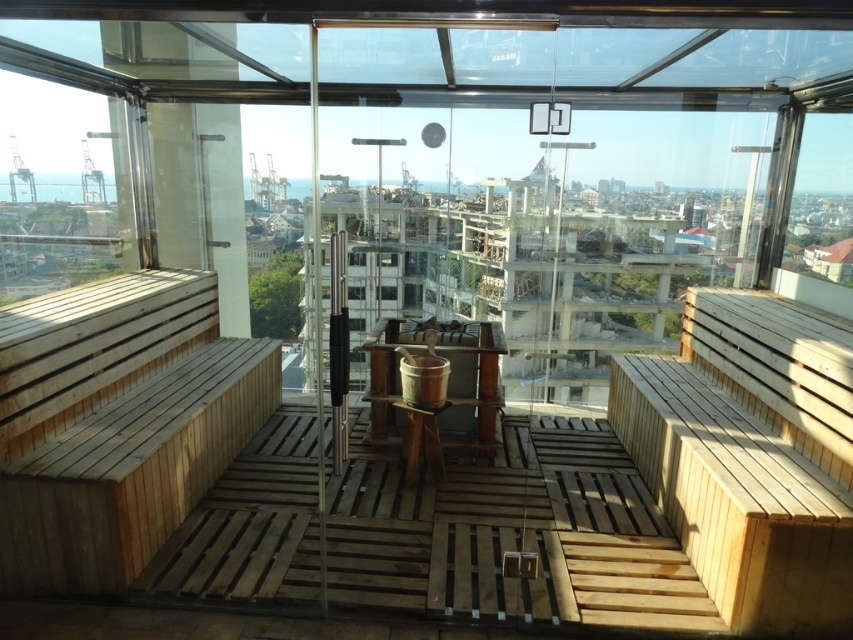
You are planning to place a large potted plant between the light brown wooden bench at left and the natural wood bench at right in the sauna. Based on their widths, which bench should the plant be closer to?

The light brown wooden bench at left might be wider than natural wood bench at right, so the plant should be placed closer to the natural wood bench at right to ensure there is enough space.

You are planning to place a large potted plant between the natural wood bench at right and the transparent glass window at left. Considering their sizes, which object should the plant be closer to?

The natural wood bench at right has a smaller size compared to the transparent glass window at left, so the plant should be placed closer to the transparent glass window at left to balance the space.

You are standing inside the sauna and looking through the glass walls. There are two points marked on the glass at coordinates point (74, 460) and point (804, 628). Which point is closer to your eyes?

Point (74, 460) is further to the viewer than point (804, 628), so the closer point to your eyes would be point (804, 628).